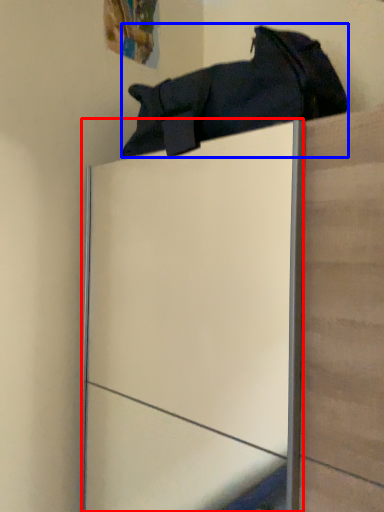
Question: Which of the following is the closest to the observer, glass door (highlighted by a red box) or footwear (highlighted by a blue box)?

Choices:
 (A) glass door
 (B) footwear

Answer: (A)